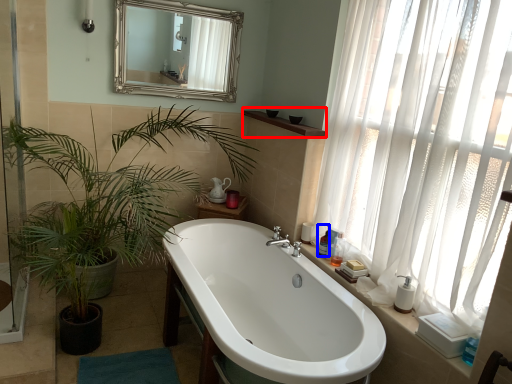
Question: Which object is further to the camera taking this photo, window sill (highlighted by a red box) or toiletry (highlighted by a blue box)?

Choices:
 (A) window sill
 (B) toiletry

Answer: (A)